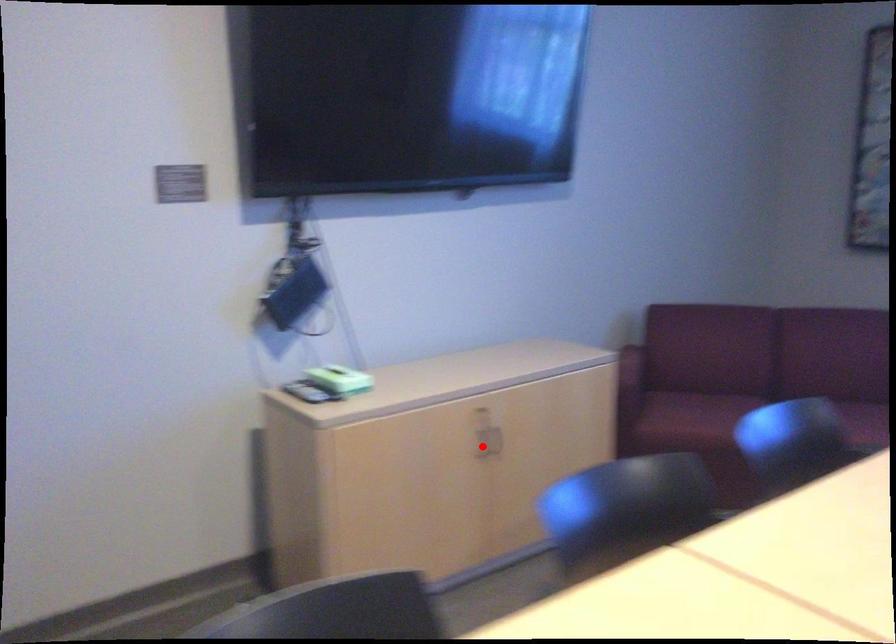
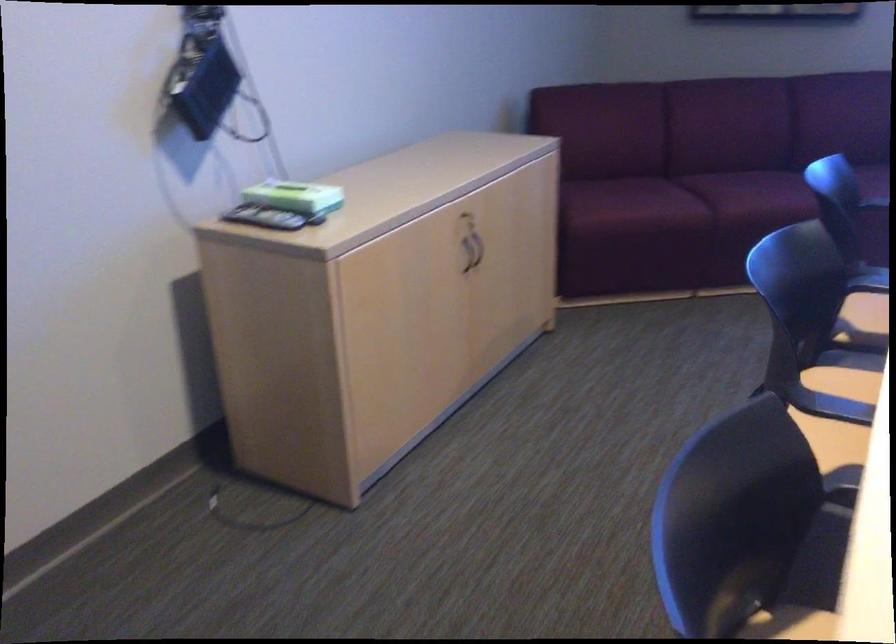
The point at the highlighted location is marked in the first image. Where is the corresponding point in the second image?

(464, 259)